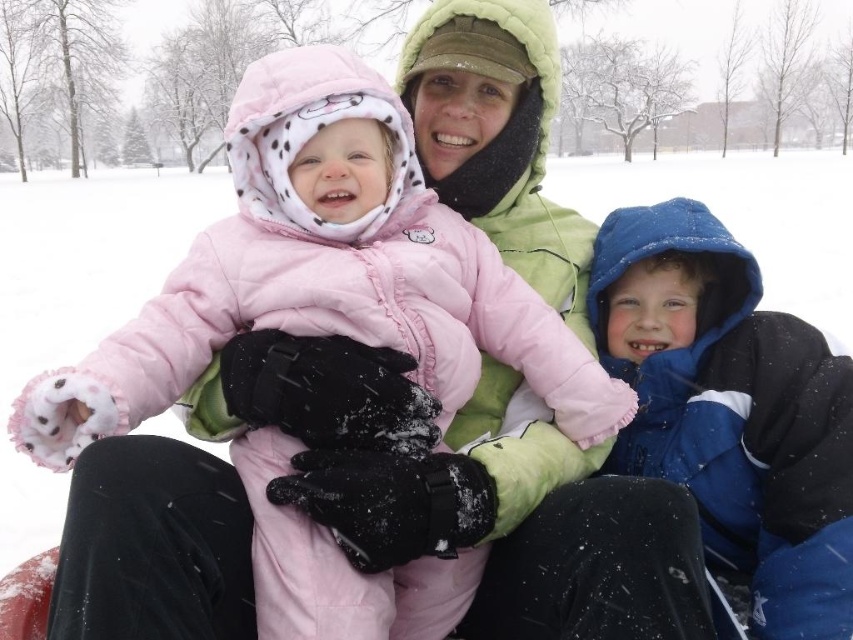
Question: Can you confirm if matte pink coat at center is positioned below blue fleece jacket at right?

Choices:
 (A) no
 (B) yes

Answer: (A)

Question: Does matte pink coat at center appear under blue fleece jacket at right?

Choices:
 (A) no
 (B) yes

Answer: (A)

Question: Among these points, which one is farthest from the camera?

Choices:
 (A) (341, 611)
 (B) (683, 344)

Answer: (B)

Question: Is matte pink coat at center bigger than blue fleece jacket at right?

Choices:
 (A) no
 (B) yes

Answer: (B)

Question: Which object appears farthest from the camera in this image?

Choices:
 (A) matte pink coat at center
 (B) blue fleece jacket at right

Answer: (B)